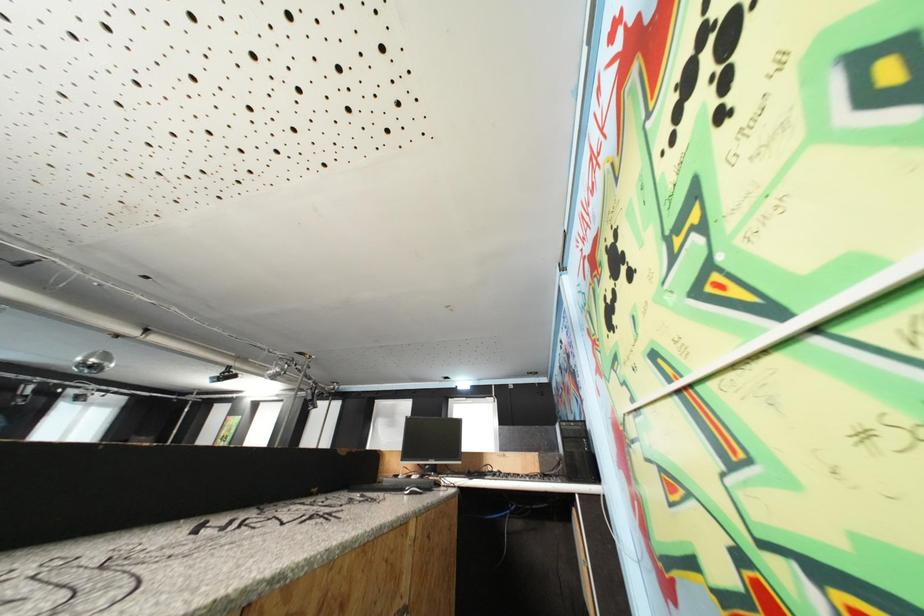
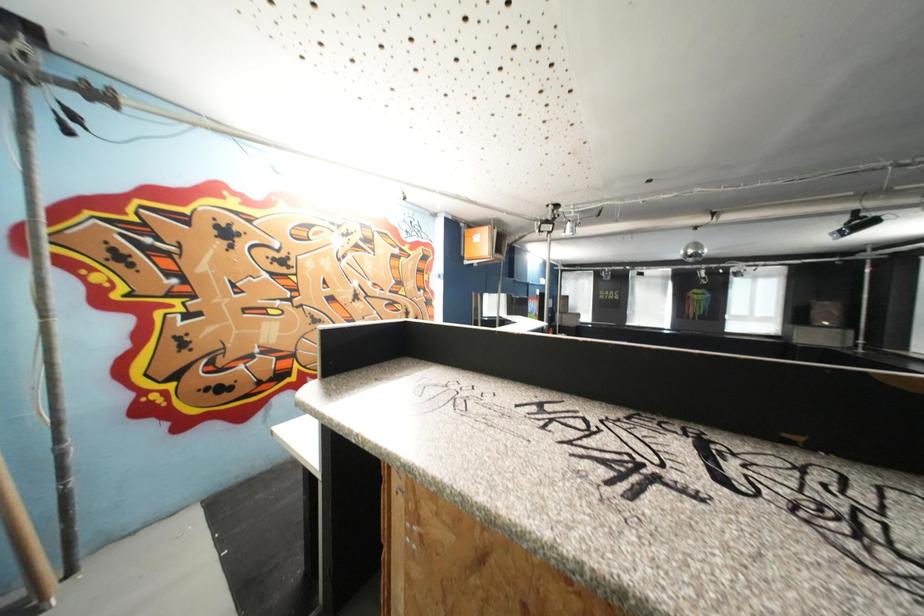
Question: Based on the continuous images, in which direction is the camera rotating? Reply with the corresponding letter.

Choices:
 (A) Left
 (B) Right
 (C) Up
 (D) Down

Answer: (A)